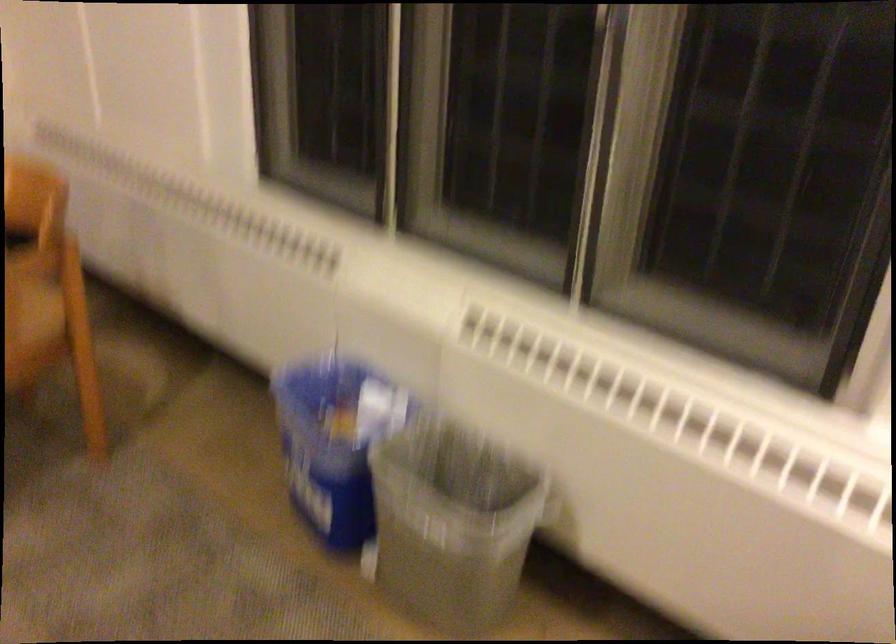
Identify the location of chair sitting surface. Image resolution: width=896 pixels, height=644 pixels. (30, 327).